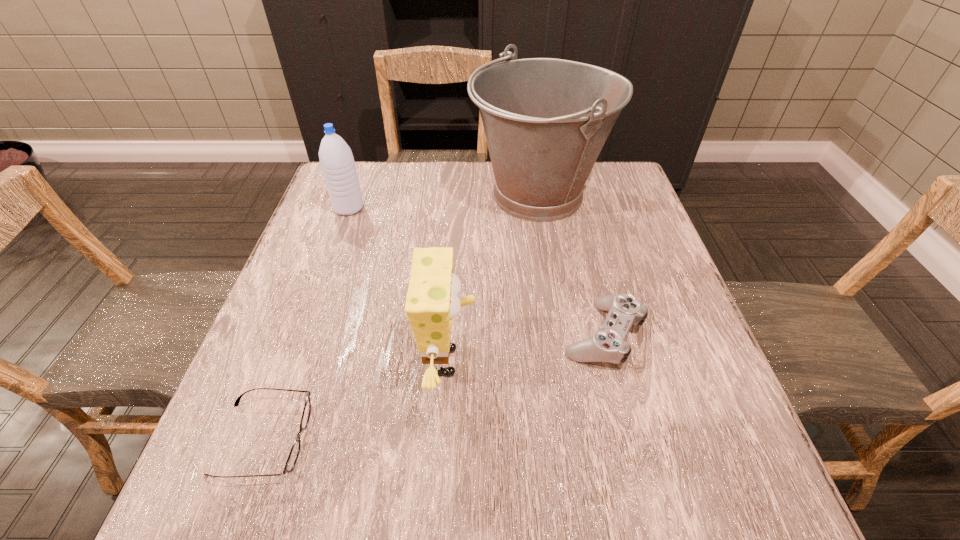
The width and height of the screenshot is (960, 540). What are the coordinates of `bucket that is at the far edge` in the screenshot? It's located at (546, 120).

Identify the location of water bottle that is positioned at the far edge. This screenshot has width=960, height=540. (x=337, y=163).

Locate an element on the screen. object present at the near edge is located at coordinates (294, 452).

Identify the location of water bottle located in the left edge section of the desktop. The height and width of the screenshot is (540, 960). (337, 163).

In order to click on spectacles at the left edge in this screenshot , I will do `click(294, 452)`.

Find the location of `bucket located in the right edge section of the desktop`. bucket located in the right edge section of the desktop is located at coordinates (546, 120).

What are the coordinates of `control that is at the right edge` in the screenshot? It's located at (608, 344).

Where is `object situated at the far left corner`? object situated at the far left corner is located at coordinates (337, 163).

Where is `object that is at the near left corner`? This screenshot has width=960, height=540. object that is at the near left corner is located at coordinates (294, 452).

Where is `object that is positioned at the far right corner`? This screenshot has width=960, height=540. object that is positioned at the far right corner is located at coordinates (546, 120).